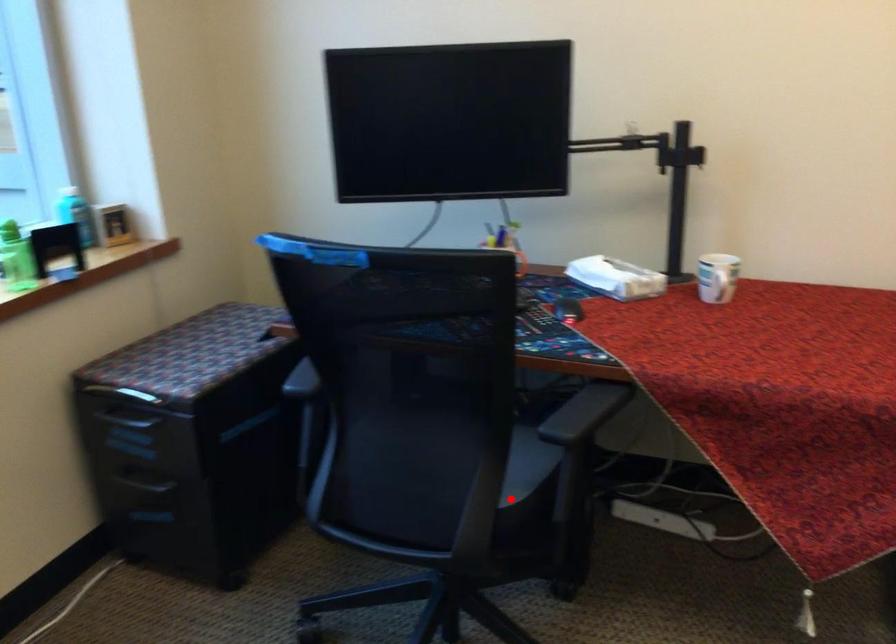
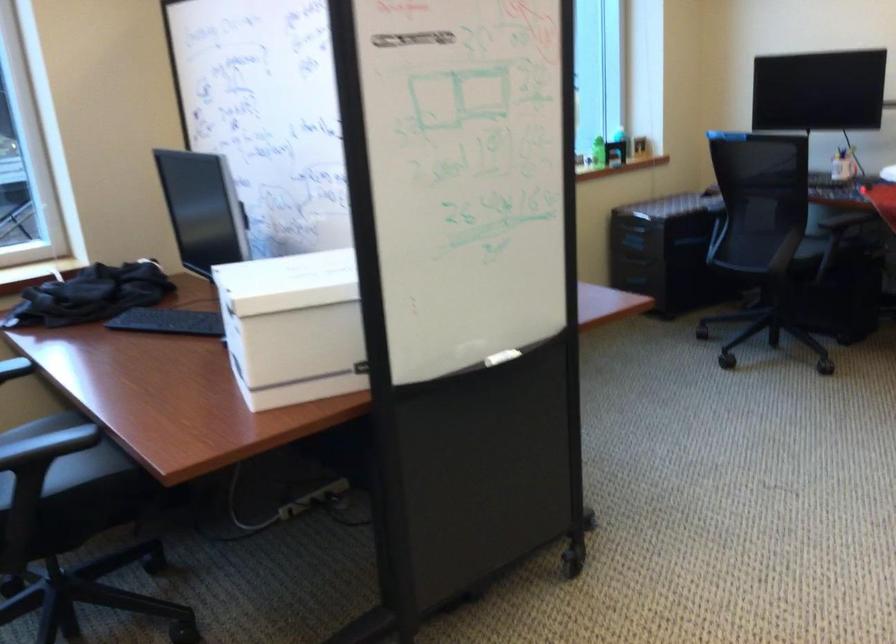
Question: I am providing you with two images of the same scene from different viewpoints. Given a red point in image1, look at the same physical point in image2. Is it:

Choices:
 (A) Closer to the viewpoint
 (B) Farther from the viewpoint

Answer: (B)